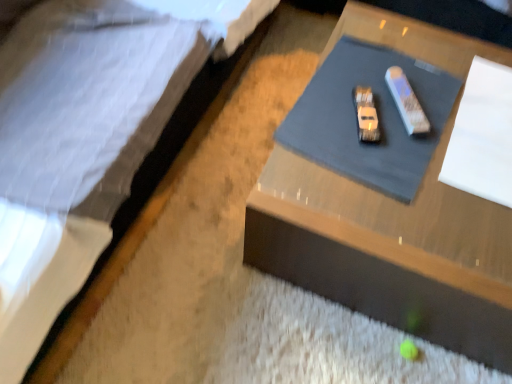
In order to face white paper at upper right, should I rotate leftwards or rightwards?

Turn right by 33.016 degrees to look at white paper at upper right.

Where is `white paper at upper right`? Image resolution: width=512 pixels, height=384 pixels. white paper at upper right is located at coordinates (482, 135).

Is wooden table at center wider or thinner than white quilted fabric at upper left?

wooden table at center is thinner than white quilted fabric at upper left.

This screenshot has height=384, width=512. In order to click on bed in front of the wooden table at center in this screenshot , I will do `click(153, 196)`.

Is wooden table at center spatially inside white quilted fabric at upper left, or outside of it?

wooden table at center exists outside the volume of white quilted fabric at upper left.

Who is more distant, wooden table at center or white quilted fabric at upper left?

wooden table at center is more distant.

Can you tell me how much white quilted fabric at upper left and white paper at upper right differ in facing direction?

The angle between the facing direction of white quilted fabric at upper left and the facing direction of white paper at upper right is 3.24 degrees.

Considering the relative sizes of white quilted fabric at upper left and white paper at upper right in the image provided, is white quilted fabric at upper left wider than white paper at upper right?

Correct, the width of white quilted fabric at upper left exceeds that of white paper at upper right.

Which object is closer to the camera, white quilted fabric at upper left or white paper at upper right?

white quilted fabric at upper left is more forward.

From a real-world perspective, relative to white paper at upper right, is white quilted fabric at upper left vertically above or below?

white quilted fabric at upper left is situated higher than white paper at upper right in the real world.

From a real-world perspective, relative to wooden table at center, is white paper at upper right vertically above or below?

From a real-world perspective, white paper at upper right is physically above wooden table at center.

Can you confirm if white paper at upper right is shorter than wooden table at center?

Indeed, white paper at upper right has a lesser height compared to wooden table at center.

Is wooden table at center completely or partially inside white paper at upper right?

No, wooden table at center is located outside of white paper at upper right.

Is point (457, 165) behind point (417, 198)?

Yes, point (457, 165) is farther from viewer.

Does point (486, 274) appear closer or farther from the camera than point (509, 90)?

Point (486, 274) appears to be closer to the viewer than point (509, 90).

Is wooden table at center positioned far away from white paper at upper right?

No, wooden table at center is not far away from white paper at upper right.

Is wooden table at center oriented away from white paper at upper right?

No, wooden table at center is not facing the opposite direction of white paper at upper right.

Considering the relative sizes of white quilted fabric at upper left and wooden table at center in the image provided, is white quilted fabric at upper left taller than wooden table at center?

Correct, white quilted fabric at upper left is much taller as wooden table at center.

Between white quilted fabric at upper left and wooden table at center, which one appears on the right side from the viewer's perspective?

wooden table at center.

Based on the photo, does white quilted fabric at upper left have a smaller size compared to wooden table at center?

Incorrect, white quilted fabric at upper left is not smaller in size than wooden table at center.

Which is nearer, (241, 54) or (349, 212)?

Clearly, point (241, 54) is more distant from the camera than point (349, 212).

Does white paper at upper right have a larger size compared to white quilted fabric at upper left?

No.

In the scene shown: Which object is wider, white paper at upper right or white quilted fabric at upper left?

white quilted fabric at upper left.

From a real-world perspective, is white paper at upper right below white quilted fabric at upper left?

Yes.

Find the location of `table below the white quilted fabric at upper left (from the image's perspective)`. table below the white quilted fabric at upper left (from the image's perspective) is located at coordinates (390, 250).

This screenshot has height=384, width=512. I want to click on bed on the left of white paper at upper right, so click(x=153, y=196).

Considering their positions, is white paper at upper right positioned further to wooden table at center than white quilted fabric at upper left?

white quilted fabric at upper left is further to wooden table at center.

Which object lies nearer to the anchor point white quilted fabric at upper left, wooden table at center or white paper at upper right?

wooden table at center.

Which object lies nearer to the anchor point white paper at upper right, wooden table at center or white quilted fabric at upper left?

Among the two, wooden table at center is located nearer to white paper at upper right.

Consider the image. Looking at the image, which one is located further to wooden table at center, white quilted fabric at upper left or white paper at upper right?

The object further to wooden table at center is white quilted fabric at upper left.

Based on their spatial positions, is white paper at upper right or wooden table at center further from white quilted fabric at upper left?

white paper at upper right lies further to white quilted fabric at upper left than the other object.

When comparing their distances from white paper at upper right, does white quilted fabric at upper left or wooden table at center seem further?

Based on the image, white quilted fabric at upper left appears to be further to white paper at upper right.

At what (x,y) coordinates should I click in order to perform the action: click on table situated between white quilted fabric at upper left and white paper at upper right from left to right. Please return your answer as a coordinate pair (x, y). Looking at the image, I should click on (390, 250).